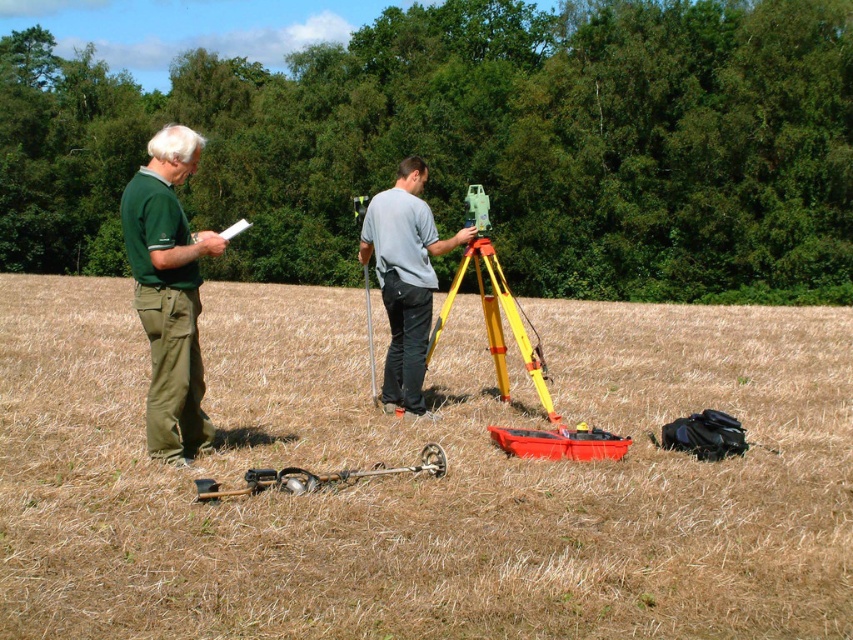
Does green cotton pants at left appear on the left side of gray matte shirt at center?

Yes, green cotton pants at left is to the left of gray matte shirt at center.

Between point (196, 289) and point (425, 300), which one is positioned behind?

Point (425, 300)

The width and height of the screenshot is (853, 640). What are the coordinates of `green cotton pants at left` in the screenshot? It's located at (167, 292).

In the scene shown: Does yellow plastic tripod at center have a lesser height compared to orange plastic bag at center?

In fact, yellow plastic tripod at center may be taller than orange plastic bag at center.

Does yellow plastic tripod at center have a greater width compared to orange plastic bag at center?

Yes.

Measure the distance between yellow plastic tripod at center and camera.

Result: A distance of 12.18 feet exists between yellow plastic tripod at center and camera.

In order to click on yellow plastic tripod at center in this screenshot , I will do `click(422, 476)`.

Which is more to the right, yellow/yellowish metal tripod at center or metallic silver detector at lower center?

Positioned to the right is yellow/yellowish metal tripod at center.

Where is `yellow/yellowish metal tripod at center`? This screenshot has width=853, height=640. yellow/yellowish metal tripod at center is located at coordinates (496, 321).